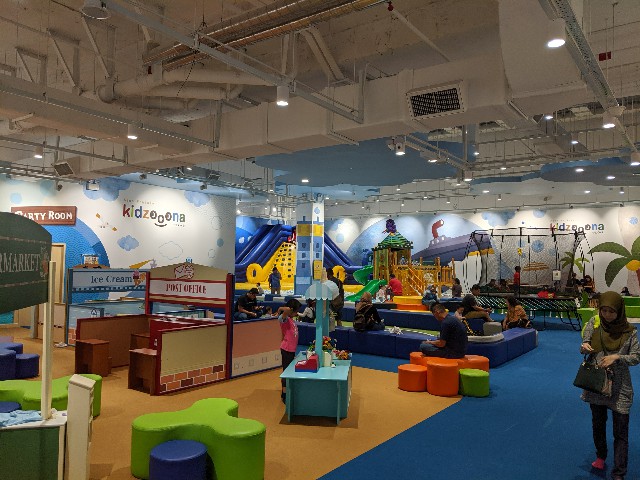
This screenshot has width=640, height=480. Find the location of `party room`. party room is located at coordinates (29, 214).